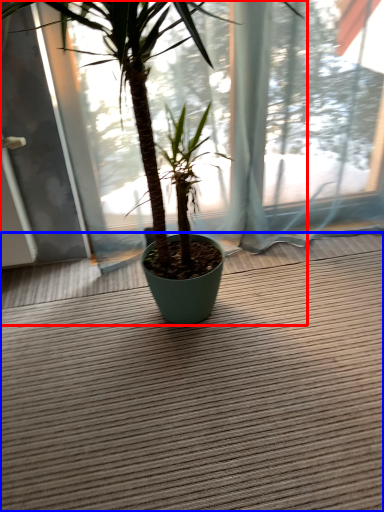
Question: Which object is closer to the camera taking this photo, houseplant (highlighted by a red box) or doormat (highlighted by a blue box)?

Choices:
 (A) houseplant
 (B) doormat

Answer: (A)